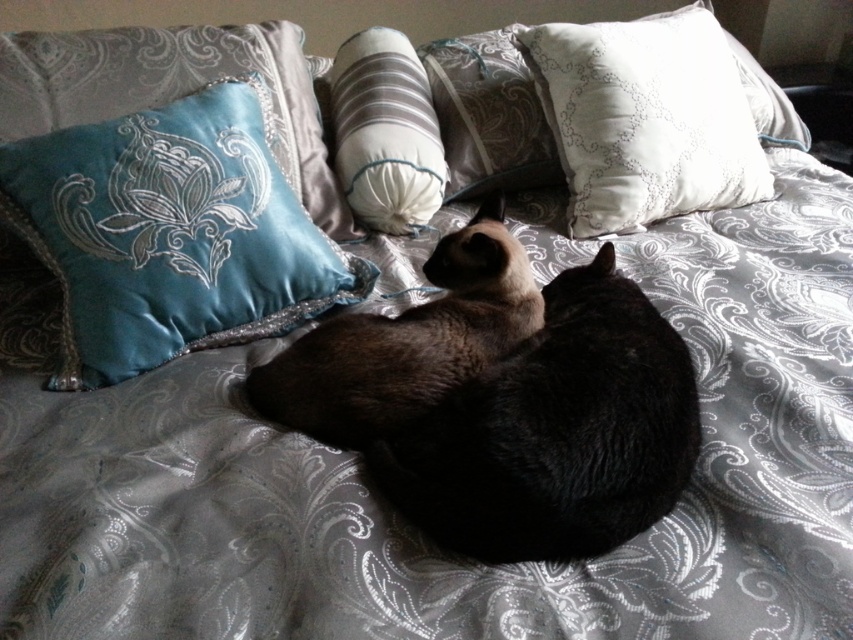
Question: Is teal velvet pillow at upper left closer to the viewer compared to satin brown cat at center?

Choices:
 (A) no
 (B) yes

Answer: (A)

Question: Based on their relative distances, which object is farther from the teal velvet pillow at upper left?

Choices:
 (A) white satin pillow at upper right
 (B) silky white pillow at center
 (C) satin brown cat at center
 (D) white soft pillow at center

Answer: (A)

Question: Which point is closer to the camera taking this photo?

Choices:
 (A) (479, 160)
 (B) (350, 96)

Answer: (B)

Question: Which point is closer to the camera?

Choices:
 (A) white soft pillow at center
 (B) white satin pillow at upper right
 (C) silky white pillow at center
 (D) smokey brown fur at center

Answer: (D)

Question: In this image, where is satin brown cat at center located relative to silky white pillow at center?

Choices:
 (A) left
 (B) right

Answer: (A)

Question: Does smokey brown fur at center have a lesser width compared to white satin pillow at upper right?

Choices:
 (A) no
 (B) yes

Answer: (B)